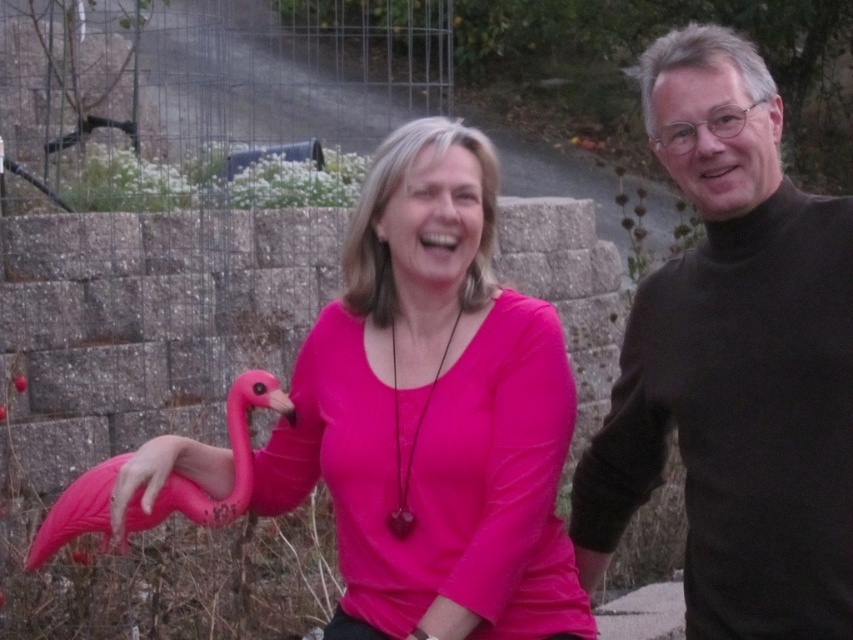
You are planning to take a photo of the black turtleneck sweater at right and the pink plastic flamingo at lower left. Which object should you focus on first if you want to include both in the frame without moving the camera?

The black turtleneck sweater at right is larger than the pink plastic flamingo at lower left, so you should focus on the black turtleneck sweater at right first to ensure it fits properly in the frame.

You are taking a photo of the black turtleneck sweater at right and the pink matte plastic flamingo at center. Which object is closer to the camera?

The pink matte plastic flamingo at center is closer to the camera because the black turtleneck sweater at right is behind it.